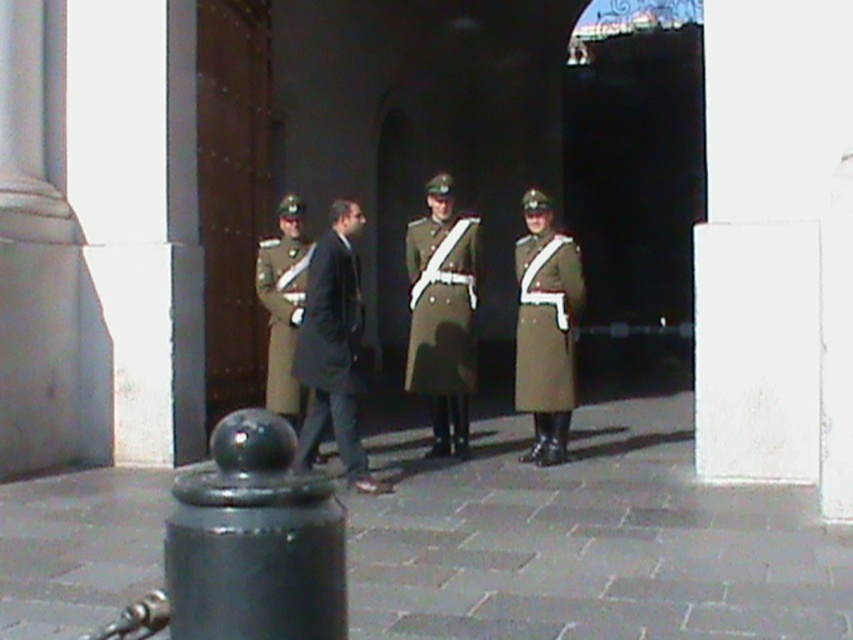
Does dark gray wool coat at center have a lesser height compared to olive green wool coat at center?

Incorrect, dark gray wool coat at center's height does not fall short of olive green wool coat at center's.

Can you confirm if dark gray wool coat at center is positioned to the left of olive green wool coat at center?

No, dark gray wool coat at center is not to the left of olive green wool coat at center.

Who is more distant from viewer, (x=338, y=260) or (x=260, y=262)?

The point (x=260, y=262) is behind.

This screenshot has height=640, width=853. I want to click on dark gray wool coat at center, so click(x=334, y=348).

Is military green uniform at center positioned behind olive green wool coat at center?

Yes, military green uniform at center is further from the viewer.

Does military green uniform at center have a lesser width compared to olive green wool coat at center?

No, military green uniform at center is not thinner than olive green wool coat at center.

Who is more forward, (460, 400) or (271, 310)?

Point (271, 310) is in front.

Where is `military green uniform at center`? This screenshot has height=640, width=853. military green uniform at center is located at coordinates (444, 314).

Who is positioned more to the left, military green uniform at center or dark gray wool coat at center?

dark gray wool coat at center

Who is more forward, (x=432, y=289) or (x=334, y=211)?

Point (x=334, y=211)

In order to click on military green uniform at center in this screenshot , I will do `click(444, 314)`.